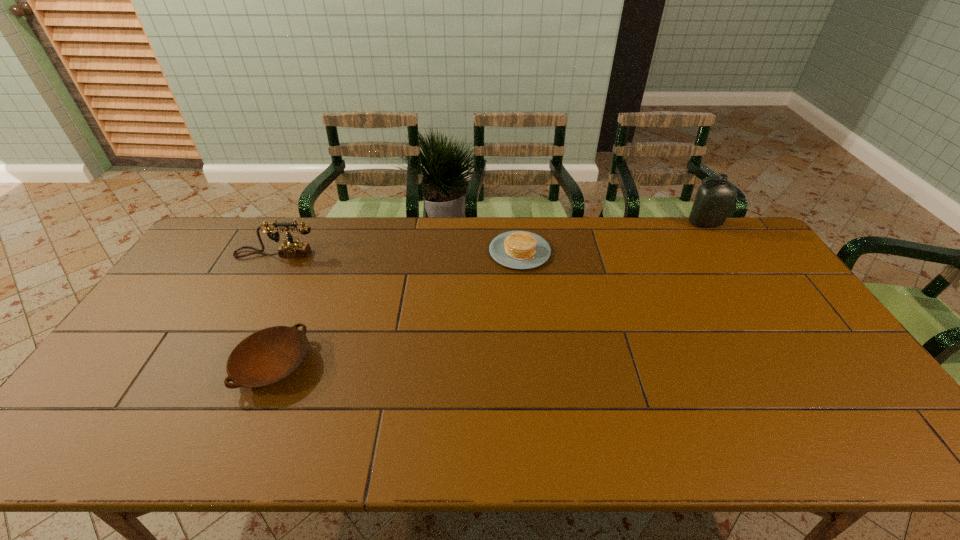
Identify which object is the nearest to the third object from left to right. Please provide its 2D coordinates. Your answer should be formatted as a tuple, i.e. [(x, y)], where the tuple contains the x and y coordinates of a point satisfying the conditions above.

[(714, 200)]

Locate an element on the screen. vacant position in the image that satisfies the following two spatial constraints: 1. on the back side of the second object from right to left; 2. on the right side of the nearest object is located at coordinates (322, 251).

You are a GUI agent. You are given a task and a screenshot of the screen. Output one action in this format:
    pyautogui.click(x=<x>, y=<y>)
    Task: Click on the blank space that satisfies the following two spatial constraints: 1. on the front-facing side of the nearest object; 2. on the left side of the third shortest object
    The height and width of the screenshot is (540, 960).
    Given the screenshot: What is the action you would take?
    pyautogui.click(x=216, y=364)